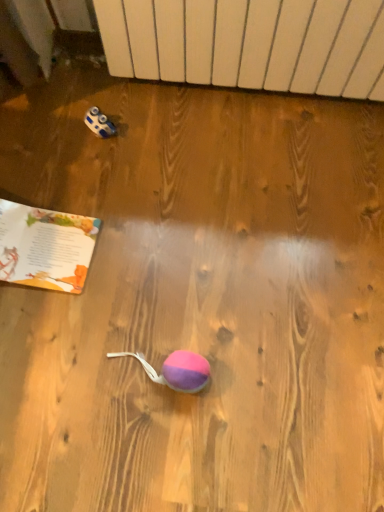
What do you see at coordinates (45, 247) in the screenshot? Image resolution: width=384 pixels, height=512 pixels. I see `paperback book at bottom left` at bounding box center [45, 247].

Locate an element on the screen. This screenshot has height=512, width=384. paperback book at bottom left is located at coordinates [x=45, y=247].

In order to face paperback book at bottom left, should I rotate leftwards or rightwards?

To align with it, rotate left about 22.923°.

This screenshot has height=512, width=384. What do you see at coordinates (249, 42) in the screenshot?
I see `white matte radiator at upper center` at bounding box center [249, 42].

Where is `white matte radiator at upper center`? white matte radiator at upper center is located at coordinates (249, 42).

Image resolution: width=384 pixels, height=512 pixels. I want to click on paperback book at bottom left, so click(x=45, y=247).

Consider the image. Is white matte radiator at upper center at the right side of paperback book at bottom left?

Indeed, white matte radiator at upper center is positioned on the right side of paperback book at bottom left.

Is white matte radiator at upper center in front of or behind paperback book at bottom left in the image?

Visually, white matte radiator at upper center is located in front of paperback book at bottom left.

Which is more distant, (362, 82) or (23, 263)?

The point (362, 82) is farther.

From the image's perspective, which object appears higher, white matte radiator at upper center or paperback book at bottom left?

white matte radiator at upper center.

From a real-world perspective, which is physically below, white matte radiator at upper center or paperback book at bottom left?

paperback book at bottom left, from a real-world perspective.

Is white matte radiator at upper center wider than paperback book at bottom left?

No, white matte radiator at upper center is not wider than paperback book at bottom left.

Considering the relative sizes of white matte radiator at upper center and paperback book at bottom left in the image provided, is white matte radiator at upper center taller than paperback book at bottom left?

Yes, white matte radiator at upper center is taller than paperback book at bottom left.

In terms of size, does white matte radiator at upper center appear bigger or smaller than paperback book at bottom left?

In the image, white matte radiator at upper center appears to be larger than paperback book at bottom left.

Is paperback book at bottom left completely or partially inside white matte radiator at upper center?

No, paperback book at bottom left is not a part of white matte radiator at upper center.

Are white matte radiator at upper center and paperback book at bottom left located far from each other?

No.

In the scene shown: Is white matte radiator at upper center turned away from paperback book at bottom left?

That's not correct — white matte radiator at upper center is not looking away from paperback book at bottom left.

What's the angular difference between white matte radiator at upper center and paperback book at bottom left's facing directions?

The angle between the facing direction of white matte radiator at upper center and the facing direction of paperback book at bottom left is 5.48 degrees.

This screenshot has width=384, height=512. What are the coordinates of `book behind the white matte radiator at upper center` in the screenshot? It's located at (45, 247).

Visually, is paperback book at bottom left positioned to the left or to the right of white matte radiator at upper center?

Clearly, paperback book at bottom left is on the left of white matte radiator at upper center in the image.

Is the position of paperback book at bottom left more distant than that of white matte radiator at upper center?

Yes, paperback book at bottom left is behind white matte radiator at upper center.

In the scene shown: Which point is more distant from viewer, (0, 228) or (245, 8)?

The point (0, 228) is farther.

From the image's perspective, is paperback book at bottom left on white matte radiator at upper center?

Actually, paperback book at bottom left appears below white matte radiator at upper center in the image.

From a real-world perspective, between paperback book at bottom left and white matte radiator at upper center, who is vertically lower?

In real-world perspective, paperback book at bottom left is lower.

Considering the sizes of objects paperback book at bottom left and white matte radiator at upper center in the image provided, who is wider, paperback book at bottom left or white matte radiator at upper center?

Wider between the two is paperback book at bottom left.

Is paperback book at bottom left shorter than white matte radiator at upper center?

Yes.

Considering the relative sizes of paperback book at bottom left and white matte radiator at upper center in the image provided, is paperback book at bottom left smaller than white matte radiator at upper center?

Yes, paperback book at bottom left is smaller than white matte radiator at upper center.

Choose the correct answer: Is paperback book at bottom left inside white matte radiator at upper center or outside it?

paperback book at bottom left cannot be found inside white matte radiator at upper center.

Is there a large distance between paperback book at bottom left and white matte radiator at upper center?

Actually, paperback book at bottom left and white matte radiator at upper center are a little close together.

Could you tell me if paperback book at bottom left is facing white matte radiator at upper center?

No, paperback book at bottom left is not oriented towards white matte radiator at upper center.

What's the angular difference between paperback book at bottom left and white matte radiator at upper center's facing directions?

The angle between the facing direction of paperback book at bottom left and the facing direction of white matte radiator at upper center is 5.48 degrees.

Identify the location of radiator in front of the paperback book at bottom left. [x=249, y=42].

Locate an element on the screen. This screenshot has width=384, height=512. radiator in front of the paperback book at bottom left is located at coordinates (249, 42).

Find the location of a particular element. radiator above the paperback book at bottom left (from the image's perspective) is located at coordinates coord(249,42).